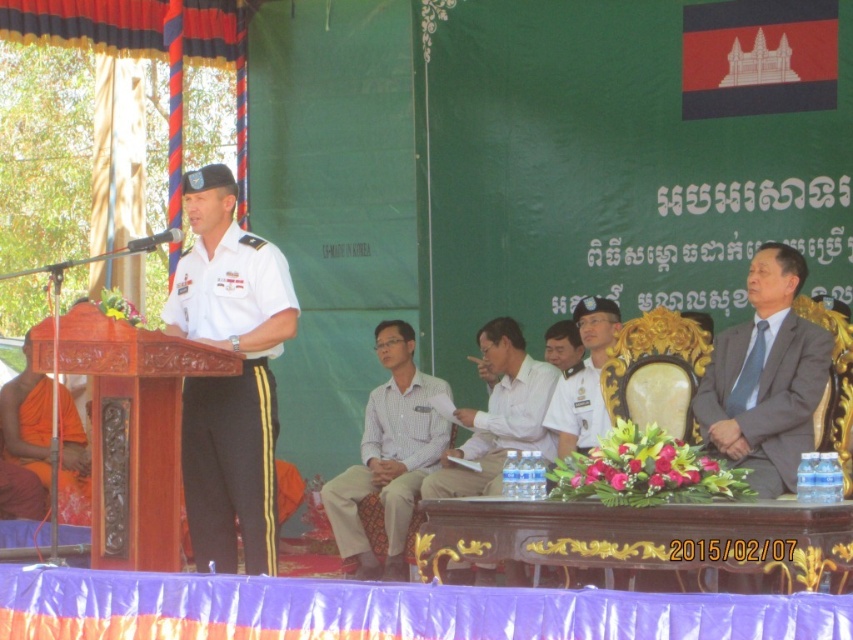
Question: In this image, where is dark brown polished wood table at center located relative to white cotton shirt at center?

Choices:
 (A) right
 (B) left

Answer: (A)

Question: Which point appears farthest from the camera in this image?

Choices:
 (A) (579, 419)
 (B) (230, 394)
 (C) (508, 428)

Answer: (C)

Question: Considering the real-world distances, which object is farthest from the white shirt at center?

Choices:
 (A) satin gray suit at right
 (B) dark brown polished wood table at center
 (C) white matte uniform at center
 (D) white uniform at center

Answer: (B)

Question: Is the position of dark brown polished wood table at center less distant than that of white matte uniform at center?

Choices:
 (A) no
 (B) yes

Answer: (B)

Question: Can you confirm if white shirt at center is positioned to the left of orange cloth at left?

Choices:
 (A) no
 (B) yes

Answer: (A)

Question: Which of the following is the closest to the observer?

Choices:
 (A) orange cloth at left
 (B) white shirt at center
 (C) white matte uniform at center
 (D) white cotton shirt at center

Answer: (C)